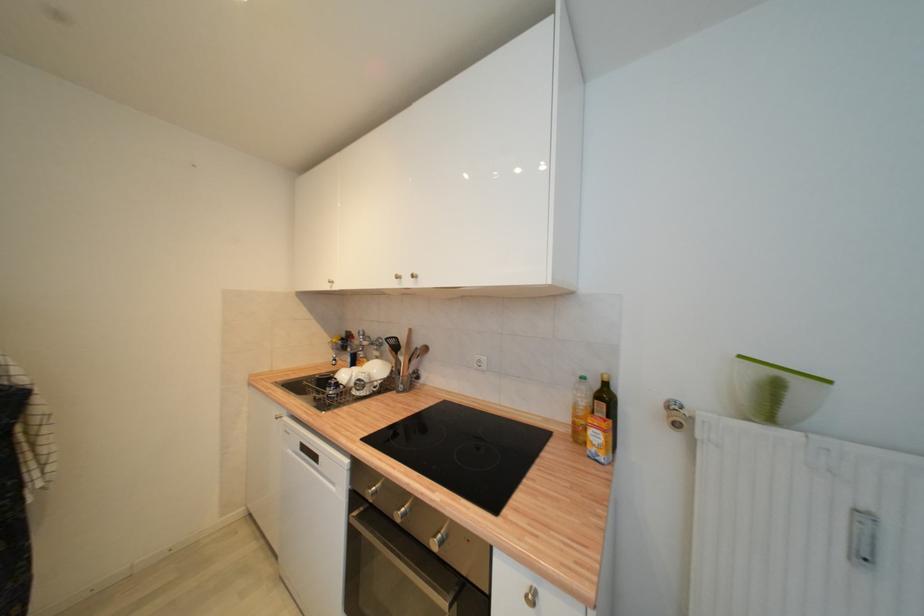
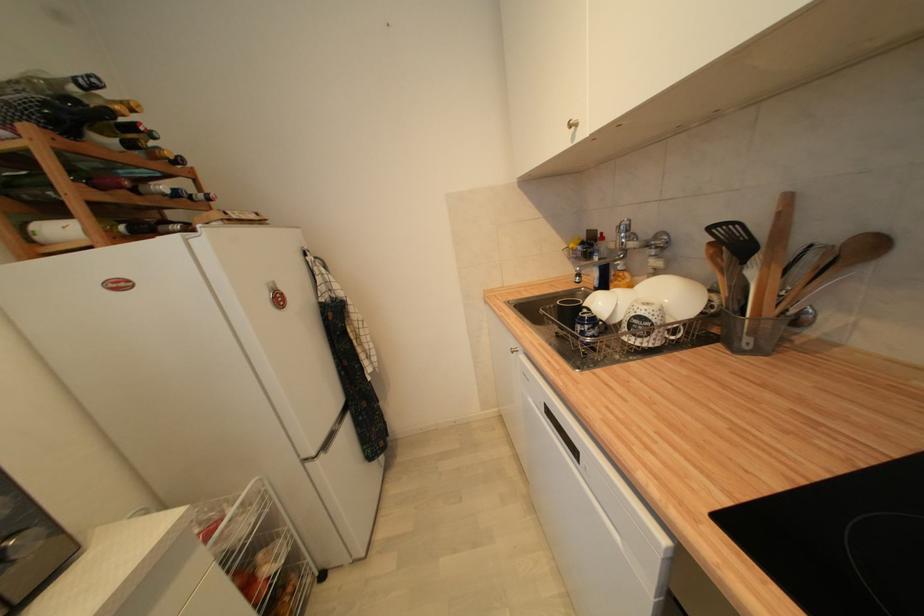
In the second image, find the point that corresponds to point 334,284 in the first image.

(576, 128)